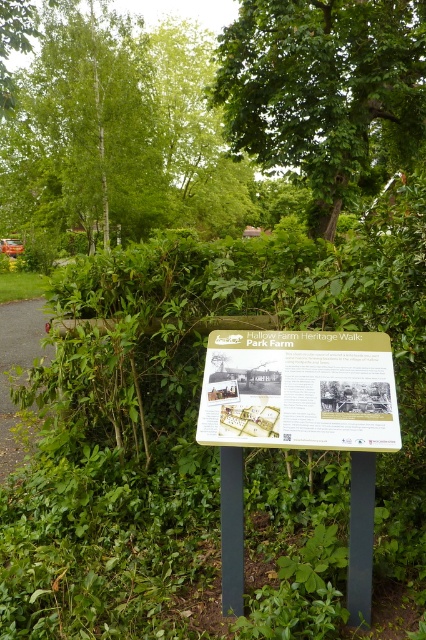
From the picture: Who is lower down, birch bark tree at left or wooden signboard at center?

wooden signboard at center

Is birch bark tree at left wider than wooden signboard at center?

Yes.

Is point (37, 172) in front of point (218, 417)?

No, (37, 172) is further to viewer.

Locate an element on the screen. birch bark tree at left is located at coordinates (86, 131).

Is green leafy tree at upper center positioned before gravel path at left?

That is False.

Who is taller, green leafy tree at upper center or gravel path at left?

With more height is gravel path at left.

Identify the location of green leafy tree at upper center. This screenshot has height=640, width=426. (322, 90).

Does point (367, 394) come in front of point (29, 317)?

Yes, it is.

Which is behind, point (221, 394) or point (2, 454)?

Positioned behind is point (2, 454).

You are a GUI agent. You are given a task and a screenshot of the screen. Output one action in this format:
    pyautogui.click(x=<x>, y=<y>)
    Task: Click on the wooden signboard at center
    This screenshot has height=640, width=426.
    Given the screenshot: What is the action you would take?
    pyautogui.click(x=299, y=390)